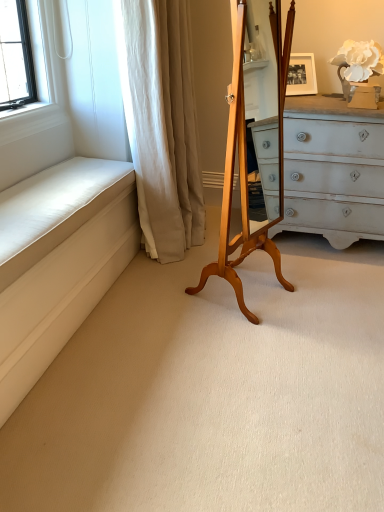
Question: In terms of size, does white fabric curtain at left appear bigger or smaller than light brown wood easel at center?

Choices:
 (A) small
 (B) big

Answer: (B)

Question: In terms of width, does white fabric curtain at left look wider or thinner when compared to light brown wood easel at center?

Choices:
 (A) wide
 (B) thin

Answer: (A)

Question: Estimate the real-world distances between objects in this image. Which object is closer to the white matte flower at upper right?

Choices:
 (A) light brown wood easel at center
 (B) white fabric curtain at left

Answer: (A)

Question: Which object is the farthest from the light brown wood easel at center?

Choices:
 (A) white matte flower at upper right
 (B) white fabric curtain at left

Answer: (A)